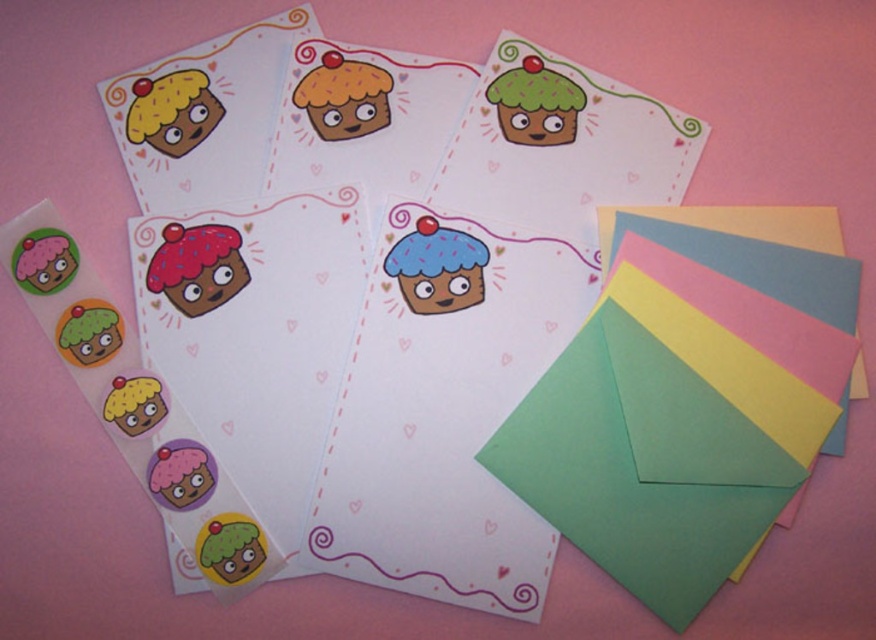
Between point (191, 278) and point (185, 84), which one is positioned behind?

The point (185, 84) is more distant.

Is matte pink cupcake at center thinner than matte yellow cupcake at upper left?

Yes.

What do you see at coordinates (196, 266) in the screenshot? I see `matte pink cupcake at center` at bounding box center [196, 266].

This screenshot has height=640, width=876. In order to click on matte pink cupcake at center in this screenshot , I will do `click(196, 266)`.

Who is taller, green matte cupcake at upper right or matte yellow cupcake at upper left?

With more height is green matte cupcake at upper right.

Which is more to the right, green matte cupcake at upper right or matte yellow cupcake at upper left?

From the viewer's perspective, green matte cupcake at upper right appears more on the right side.

Does point (499, 109) come behind point (179, 88)?

No, it is not.

Find the location of a particular element. The image size is (876, 640). green matte cupcake at upper right is located at coordinates (535, 104).

Does matte pink cupcake at center have a lesser height compared to matte pink cupcake at lower left?

Incorrect, matte pink cupcake at center's height does not fall short of matte pink cupcake at lower left's.

Identify the location of matte pink cupcake at center. (196, 266).

What do you see at coordinates (196, 266) in the screenshot?
I see `matte pink cupcake at center` at bounding box center [196, 266].

Locate an element on the screen. matte pink cupcake at center is located at coordinates (196, 266).